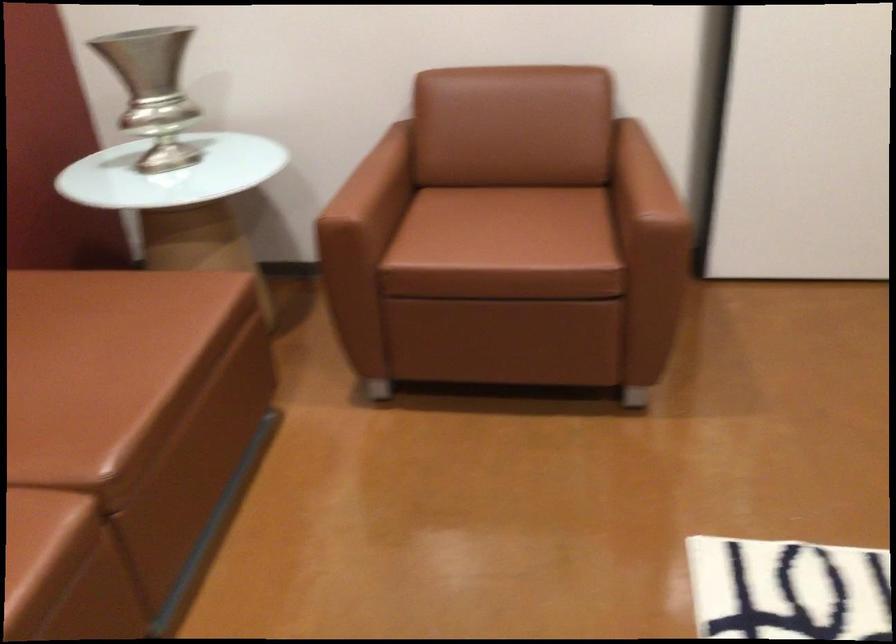
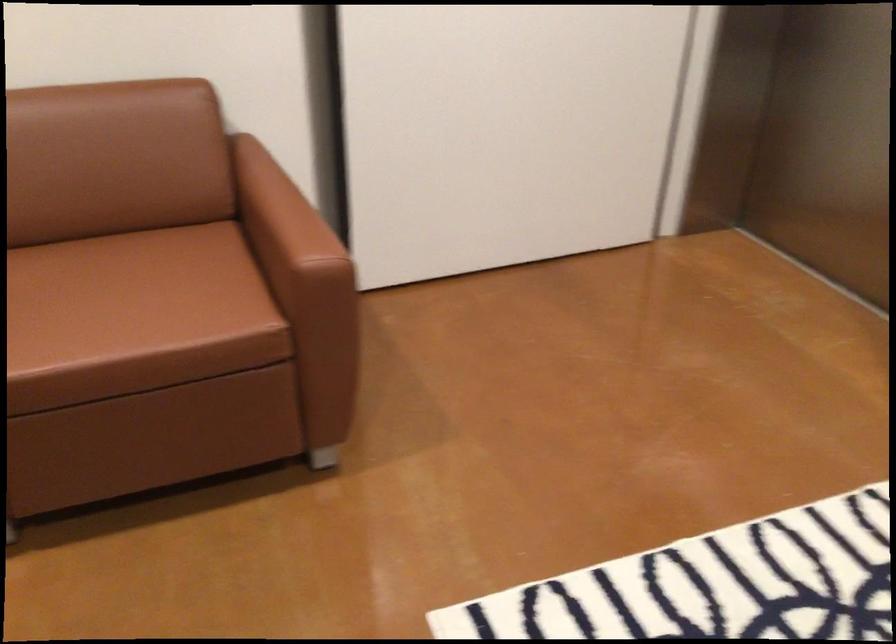
Locate, in the second image, the point that corresponds to point 506,216 in the first image.

(124, 283)